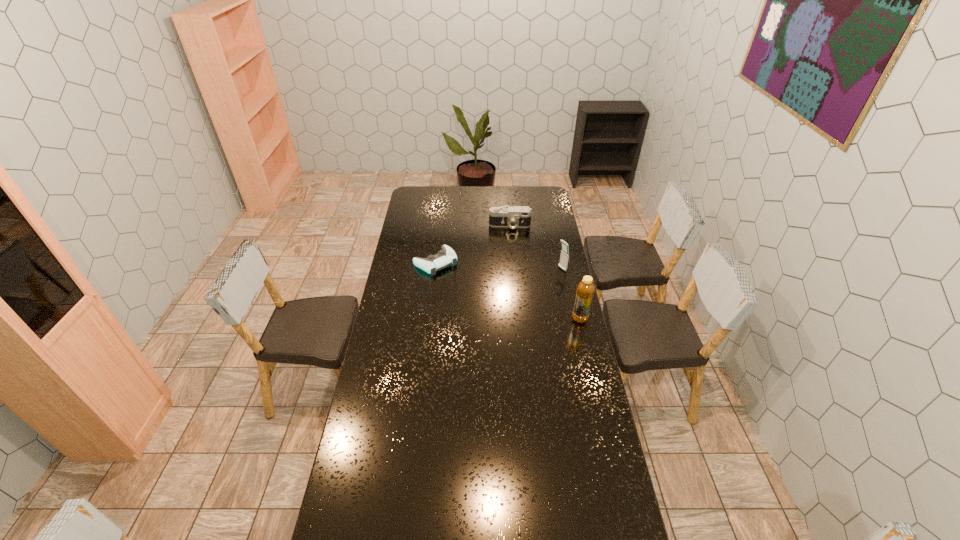
Where is `free spot on the desktop that is between the leftmost object and the tallest object and is positioned on the lens of the second shortest object`? The height and width of the screenshot is (540, 960). free spot on the desktop that is between the leftmost object and the tallest object and is positioned on the lens of the second shortest object is located at coordinates (511, 292).

Find the location of a particular element. free space on the desktop that is between the leftmost object and the bottle and is positioned on the front-facing side of the cellular telephone is located at coordinates (514, 293).